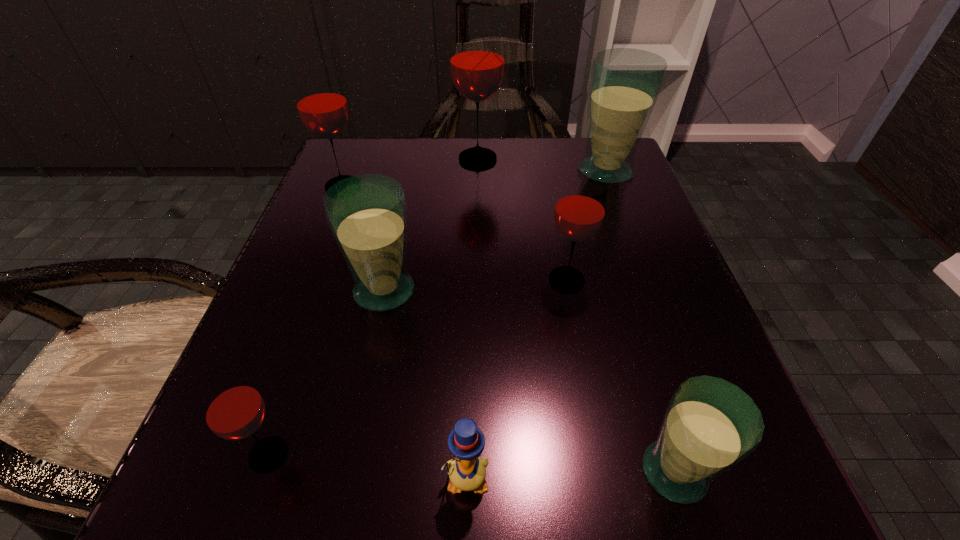
The width and height of the screenshot is (960, 540). In order to click on duckling in this screenshot , I will do `click(467, 472)`.

You are a GUI agent. You are given a task and a screenshot of the screen. Output one action in this format:
    pyautogui.click(x=<x>, y=<y>)
    Task: Click on the shortest object
    The height and width of the screenshot is (540, 960).
    Given the screenshot: What is the action you would take?
    pyautogui.click(x=467, y=472)

Where is `vacant space located on the right of the farthest red glass`? vacant space located on the right of the farthest red glass is located at coordinates (615, 159).

Find the location of a particular element. The image size is (960, 540). free space located on the front of the second farthest red glass is located at coordinates (328, 225).

The width and height of the screenshot is (960, 540). I want to click on free spot located 0.340m on the front of the biggest blue glass, so click(660, 318).

I want to click on vacant space located on the back of the fifth glass from left to right, so click(547, 179).

Image resolution: width=960 pixels, height=540 pixels. In order to click on free space located on the right of the sixth object from right to left in this screenshot , I will do `click(494, 291)`.

You are a GUI agent. You are given a task and a screenshot of the screen. Output one action in this format:
    pyautogui.click(x=<x>, y=<y>)
    Task: Click on the free space located on the right of the smallest red glass
    Image resolution: width=960 pixels, height=540 pixels.
    Given the screenshot: What is the action you would take?
    pyautogui.click(x=430, y=454)

Locate an element on the screen. The height and width of the screenshot is (540, 960). vacant space located on the left of the nearest blue glass is located at coordinates (433, 472).

I want to click on duckling located in the near edge section of the desktop, so click(x=467, y=472).